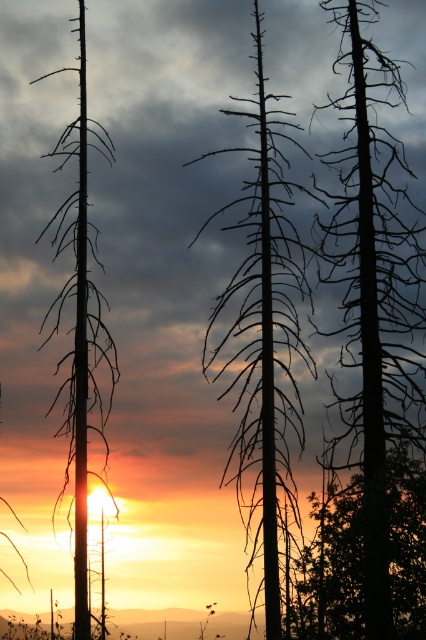
This screenshot has height=640, width=426. I want to click on black deadwood tree at center, so click(374, 296).

What do you see at coordinates (374, 296) in the screenshot? The image size is (426, 640). I see `black deadwood tree at center` at bounding box center [374, 296].

This screenshot has height=640, width=426. I want to click on black deadwood tree at center, so click(374, 296).

Is the position of black deadwood tree at center less distant than that of silhouette deadwood at left?

No, black deadwood tree at center is behind silhouette deadwood at left.

Which of these two, black deadwood tree at center or silhouette deadwood at left, stands shorter?

With less height is black deadwood tree at center.

Who is more forward, (386, 554) or (77, 19)?

Positioned in front is point (386, 554).

The height and width of the screenshot is (640, 426). In order to click on black deadwood tree at center in this screenshot , I will do [x=374, y=296].

Based on the photo, does silhouette bark tree at center have a lesser height compared to silhouette deadwood at left?

No.

What do you see at coordinates (264, 332) in the screenshot? I see `silhouette bark tree at center` at bounding box center [264, 332].

Where is `silhouette bark tree at center`? This screenshot has width=426, height=640. silhouette bark tree at center is located at coordinates (264, 332).